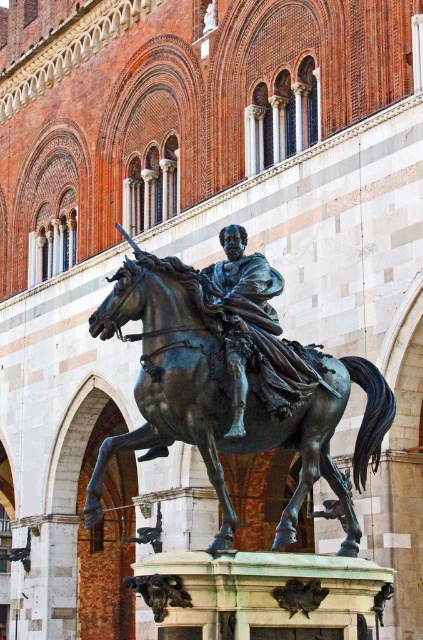
Question: Which object appears farthest from the camera in this image?

Choices:
 (A) bronze horse at center
 (B) bronze statue at center

Answer: (A)

Question: Does bronze horse at center have a greater width compared to bronze statue at center?

Choices:
 (A) yes
 (B) no

Answer: (A)

Question: From the image, what is the correct spatial relationship of bronze horse at center in relation to bronze statue at center?

Choices:
 (A) right
 (B) left

Answer: (A)

Question: Does bronze horse at center have a lesser width compared to bronze statue at center?

Choices:
 (A) no
 (B) yes

Answer: (A)